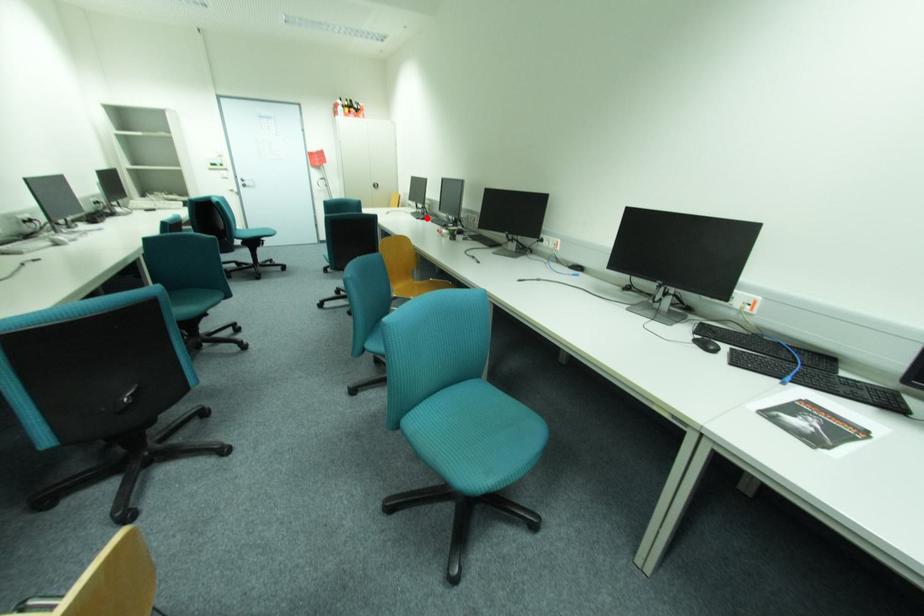
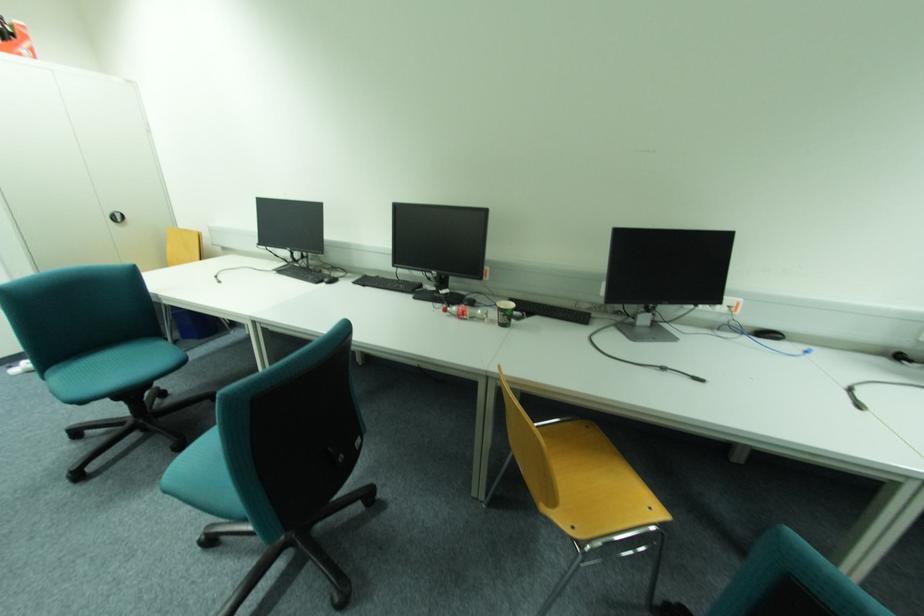
Locate, in the second image, the point that corresponds to the highlighted location in the first image.

(333, 280)